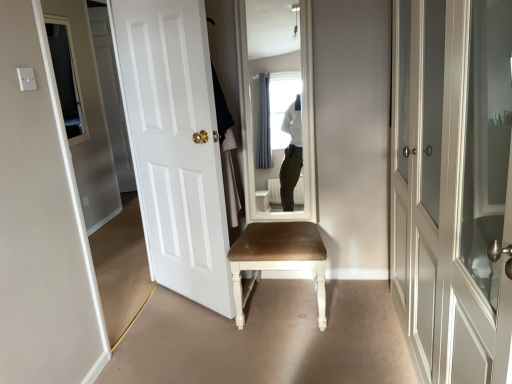
You are a GUI agent. You are given a task and a screenshot of the screen. Output one action in this format:
    pyautogui.click(x=<x>, y=<y>)
    Task: Click on the vacant area that is situated to the right of brown leather chair at center
    The width and height of the screenshot is (512, 384).
    Given the screenshot: What is the action you would take?
    pyautogui.click(x=360, y=304)